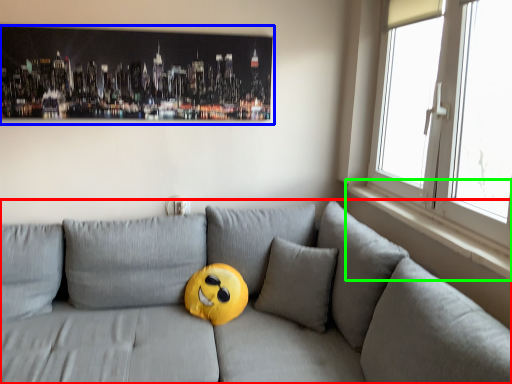
Question: Which object is positioned farthest from studio couch (highlighted by a red box)? Select from picture frame (highlighted by a blue box) and window sill (highlighted by a green box).

Choices:
 (A) picture frame
 (B) window sill

Answer: (A)